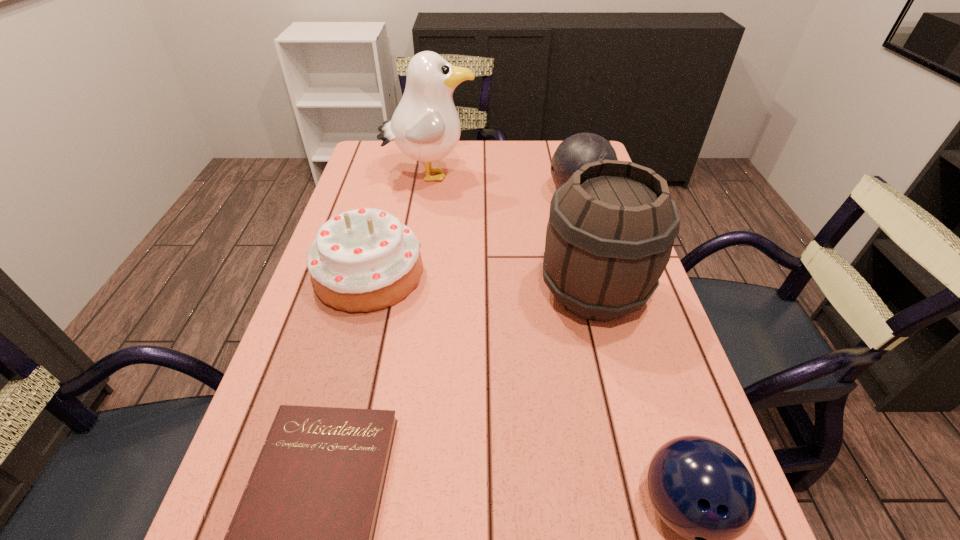
This screenshot has height=540, width=960. Find the location of `gull present at the far edge`. gull present at the far edge is located at coordinates (425, 126).

Image resolution: width=960 pixels, height=540 pixels. Identify the location of bowling ball at the far edge. (577, 150).

I want to click on gull positioned at the left edge, so click(425, 126).

The image size is (960, 540). Identify the location of cake situated at the left edge. (363, 260).

Identify the location of wine bucket at the right edge. Image resolution: width=960 pixels, height=540 pixels. (611, 229).

Find the location of a particular element. This screenshot has width=960, height=540. bowling ball located in the right edge section of the desktop is located at coordinates (577, 150).

The width and height of the screenshot is (960, 540). In order to click on object that is at the far left corner in this screenshot , I will do click(x=425, y=126).

Image resolution: width=960 pixels, height=540 pixels. I want to click on object positioned at the far right corner, so click(577, 150).

Locate an element on the screen. The width and height of the screenshot is (960, 540). vacant area at the far edge of the desktop is located at coordinates (481, 177).

Where is `free space at the left edge of the desktop`? The image size is (960, 540). free space at the left edge of the desktop is located at coordinates (398, 180).